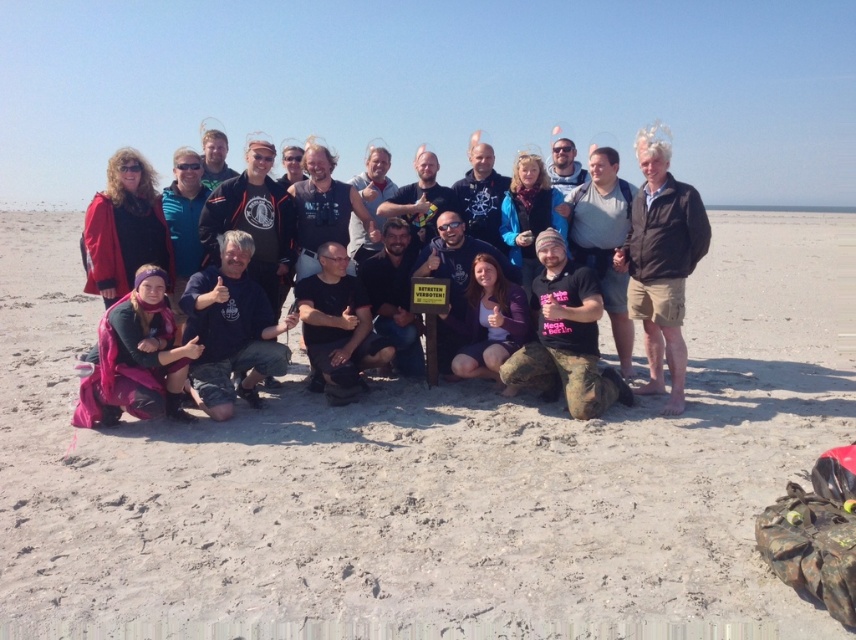
Question: Which object is the farthest from the smooth sand at center?

Choices:
 (A) pink fabric at center
 (B) brown leather jacket at right

Answer: (B)

Question: Is smooth sand at center to the right of brown leather jacket at right from the viewer's perspective?

Choices:
 (A) yes
 (B) no

Answer: (B)

Question: From the image, what is the correct spatial relationship of smooth sand at center in relation to pink fabric at center?

Choices:
 (A) below
 (B) above

Answer: (A)

Question: Which point is closer to the camera?

Choices:
 (A) smooth sand at center
 (B) brown leather jacket at right
 (C) pink fabric at center

Answer: (A)

Question: Which point is closer to the camera?

Choices:
 (A) brown leather jacket at right
 (B) smooth sand at center
 (C) pink fabric at center

Answer: (B)

Question: Can you confirm if smooth sand at center is positioned above pink fabric at center?

Choices:
 (A) yes
 (B) no

Answer: (B)